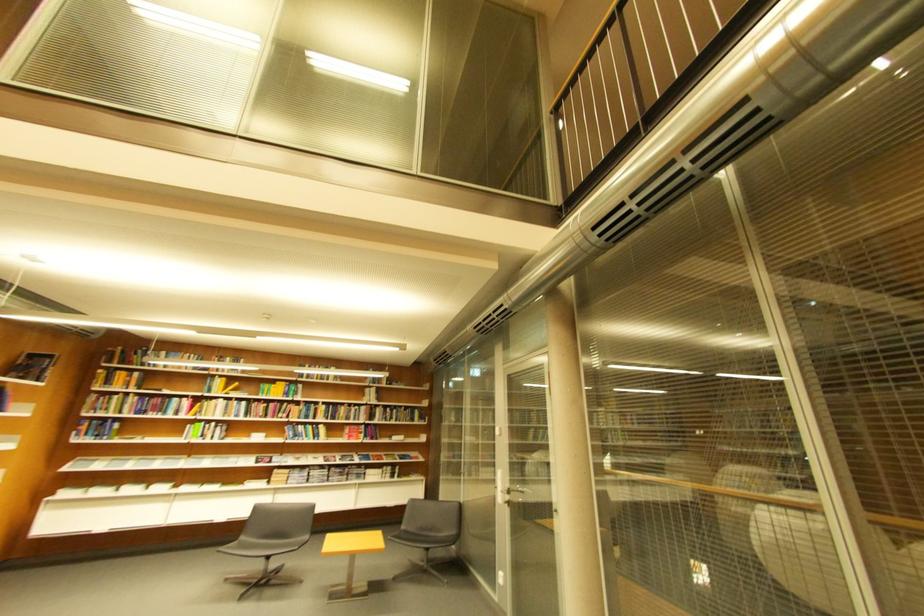
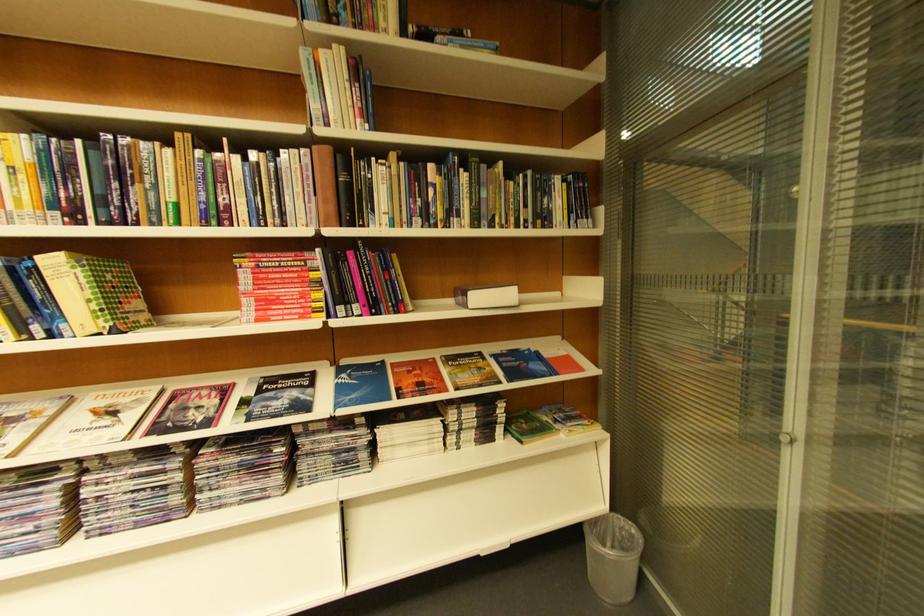
Find the pixel in the second image that matches point (379, 416) in the first image.

(342, 196)